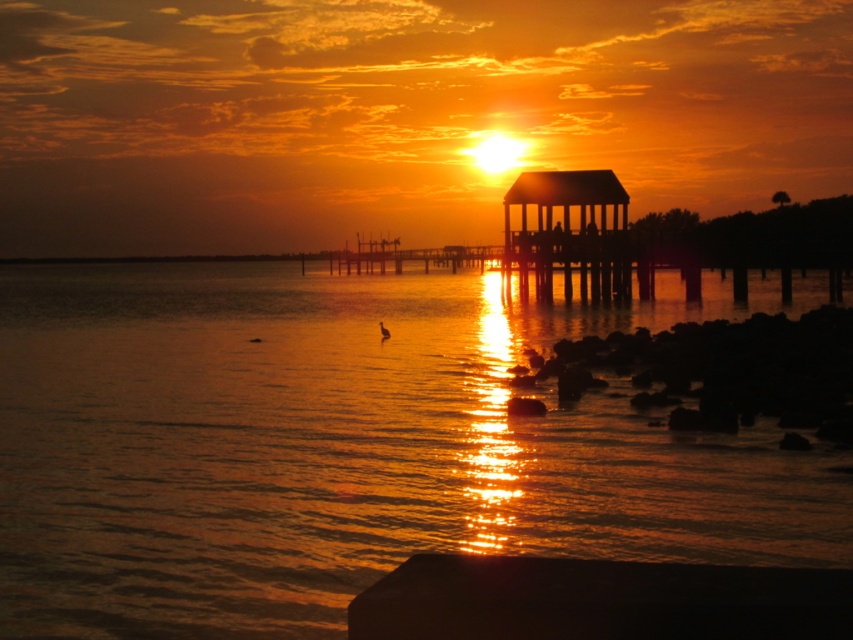
Is point (485, 508) in front of point (694, 563)?

That is False.

Can you confirm if shiny reflective water at center is positioned to the left of smooth concrete pier at center?

Yes, shiny reflective water at center is to the left of smooth concrete pier at center.

Who is more forward, (235, 593) or (384, 621)?

Point (384, 621) is in front.

Locate an element on the screen. This screenshot has width=853, height=640. shiny reflective water at center is located at coordinates (343, 445).

Find the location of `shiny reflective water at center`. shiny reflective water at center is located at coordinates (343, 445).

Between point (456, 536) and point (550, 193), which one is positioned behind?

The point (550, 193) is more distant.

In order to click on shiny reflective water at center in this screenshot , I will do `click(343, 445)`.

How far apart are smooth concrete pier at center and wooden gazebo at upper right?

smooth concrete pier at center is 208.25 feet away from wooden gazebo at upper right.

Which is behind, point (549, 593) or point (595, 182)?

Positioned behind is point (595, 182).

Is point (403, 563) closer to viewer compared to point (602, 172)?

That is True.

Where is `smooth concrete pier at center`? The height and width of the screenshot is (640, 853). smooth concrete pier at center is located at coordinates (599, 600).